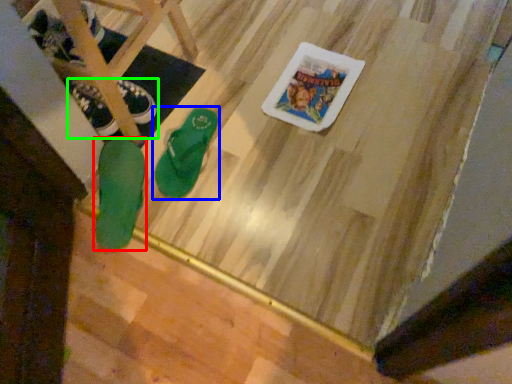
Question: Which is farther away from footwear (highlighted by a red box)? footwear (highlighted by a blue box) or footwear (highlighted by a green box)?

Choices:
 (A) footwear
 (B) footwear

Answer: (B)